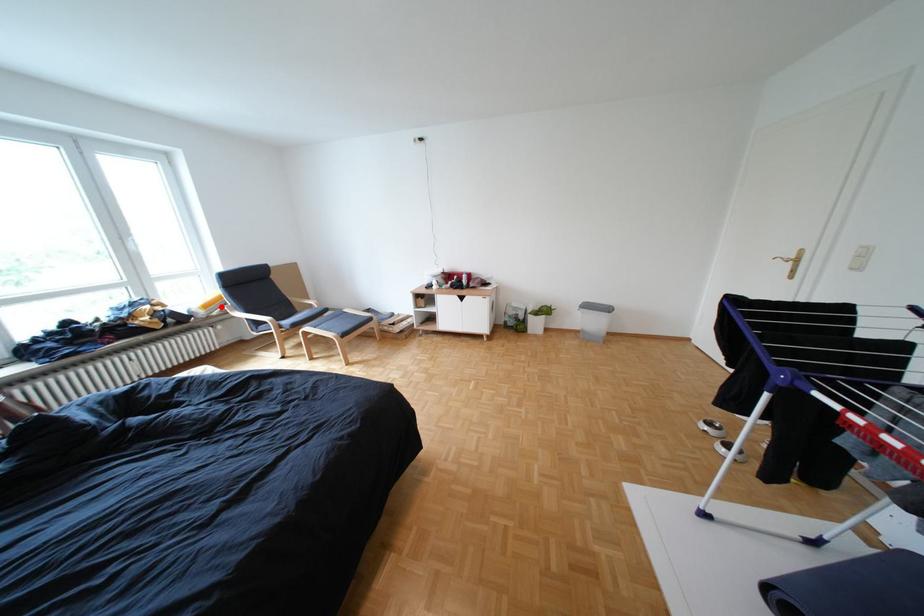
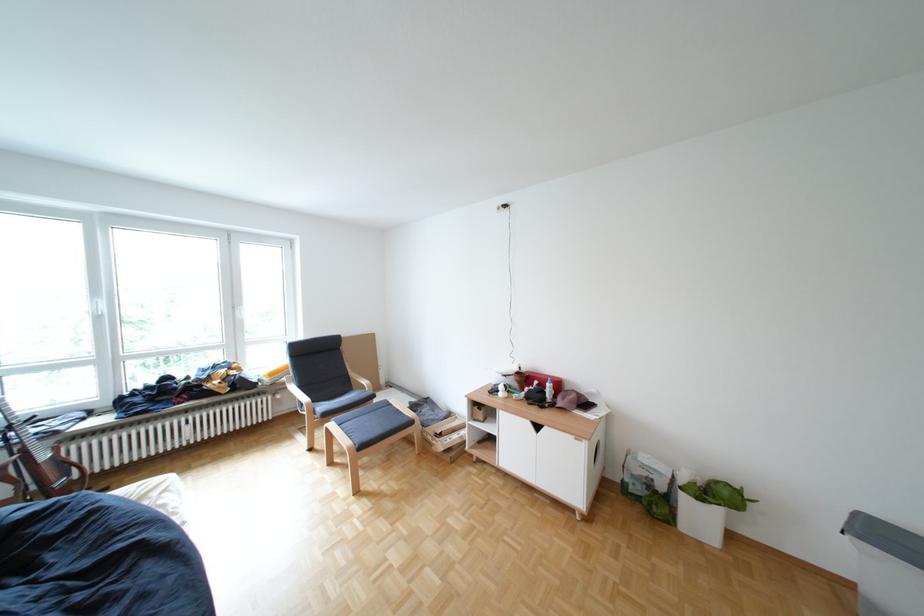
Question: I am providing you with two images of the same scene from different viewpoints. Image1 has a red point marked. In image2, the corresponding 3D location appears at what relative position? Reply with the corresponding letter.

Choices:
 (A) Closer
 (B) Farther

Answer: (B)